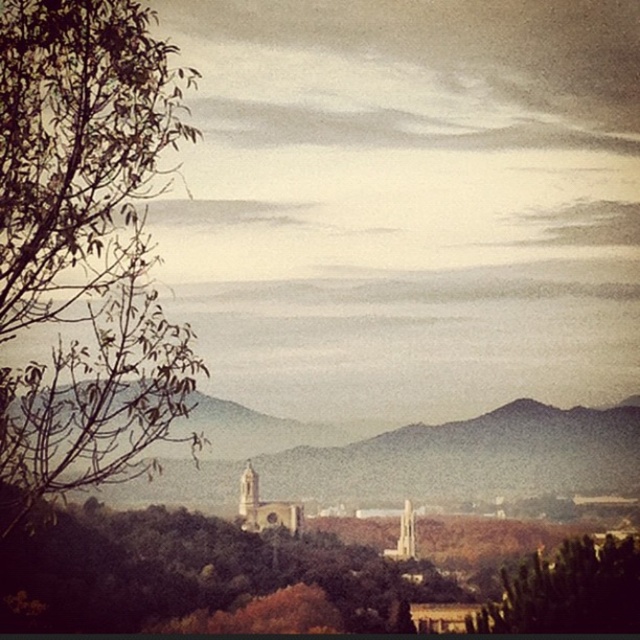
Can you confirm if green leafy tree at left is bigger than green leafy tree at lower right?

Yes, green leafy tree at left is bigger than green leafy tree at lower right.

Can you confirm if green leafy tree at left is positioned to the right of green leafy tree at lower right?

Incorrect, green leafy tree at left is not on the right side of green leafy tree at lower right.

Which is behind, point (148, 51) or point (524, 596)?

The point (524, 596) is behind.

I want to click on green leafy tree at left, so click(84, 248).

Between green leafy tree at left and brown stone church at center, which one is positioned higher?

green leafy tree at left

Is point (154, 465) less distant than point (554, 419)?

Yes, point (154, 465) is in front of point (554, 419).

Is point (10, 429) in front of point (625, 468)?

That is True.

Where is `green leafy tree at left`? green leafy tree at left is located at coordinates (84, 248).

Between brown stone church at center and green leafy tree at lower right, which one has more height?

brown stone church at center is taller.

Which is behind, point (524, 428) or point (609, 570)?

The point (609, 570) is more distant.

Find the location of a particular element. The image size is (640, 640). brown stone church at center is located at coordinates (468, 460).